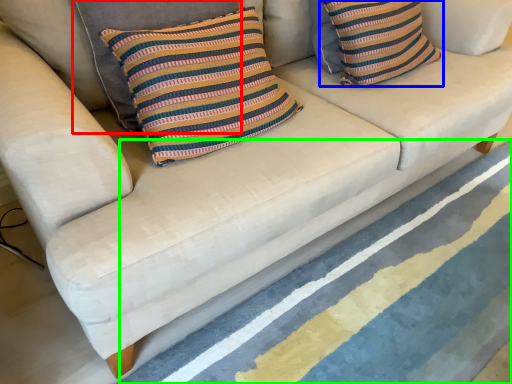
Question: Considering the real-world distances, which object is farthest from pillow (highlighted by a red box)? pillow (highlighted by a blue box) or stripe (highlighted by a green box)?

Choices:
 (A) pillow
 (B) stripe

Answer: (B)